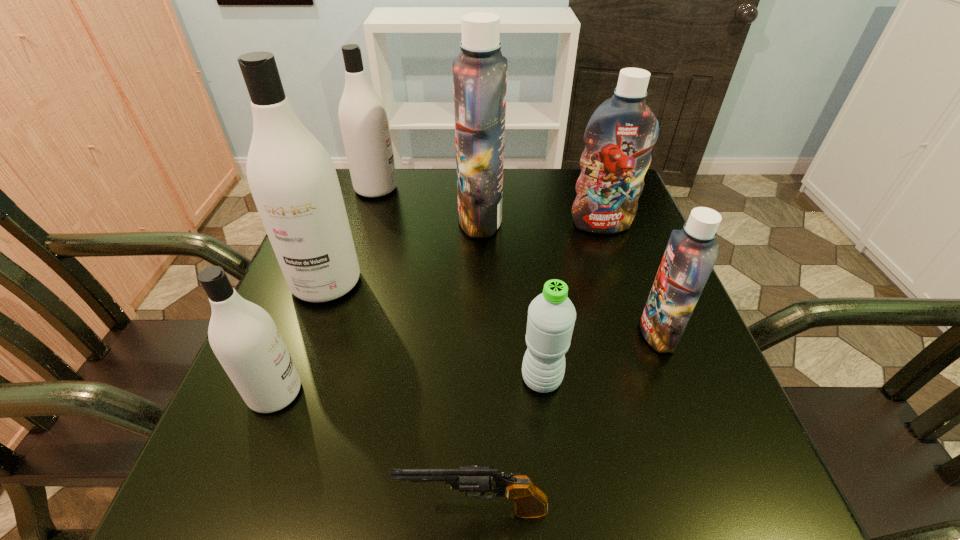
At what (x,y) coordinates should I click in order to perform the action: click on free spot located 0.130m on the front label of the smallest blue shampoo. Please return your answer as a coordinate pair (x, y). Looking at the image, I should click on (572, 333).

The width and height of the screenshot is (960, 540). What are the coordinates of `free spot located 0.110m on the front label of the smallest blue shampoo` in the screenshot? It's located at (583, 333).

Image resolution: width=960 pixels, height=540 pixels. I want to click on vacant area situated 0.070m on the front label of the smallest blue shampoo, so click(604, 333).

Where is `vacant area situated on the front-facing side of the nearest white shampoo`? vacant area situated on the front-facing side of the nearest white shampoo is located at coordinates [475, 393].

I want to click on vacant area situated on the back of the seventh tallest object, so click(x=525, y=242).

The image size is (960, 540). In order to click on vacant region located along the barrel of the gun in this screenshot , I will do `click(322, 510)`.

At what (x,y) coordinates should I click in order to perform the action: click on vacant region located 0.080m along the barrel of the gun. Please return your answer as a coordinate pair (x, y). Image resolution: width=960 pixels, height=540 pixels. Looking at the image, I should click on (344, 510).

What are the coordinates of `vacant region located 0.120m along the barrel of the gun` in the screenshot? It's located at 314,510.

The image size is (960, 540). In order to click on object located in the near edge section of the desktop in this screenshot , I will do `click(530, 502)`.

Locate an element on the screen. Image resolution: width=960 pixels, height=540 pixels. object that is at the far left corner is located at coordinates (363, 118).